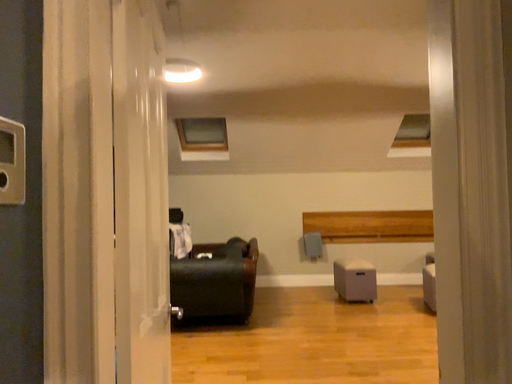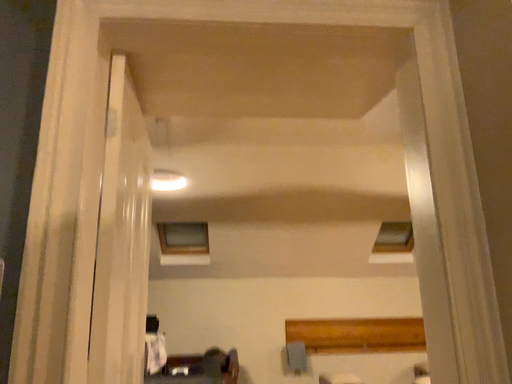
Question: How did the camera likely rotate when shooting the video?

Choices:
 (A) rotated upward
 (B) rotated downward

Answer: (A)